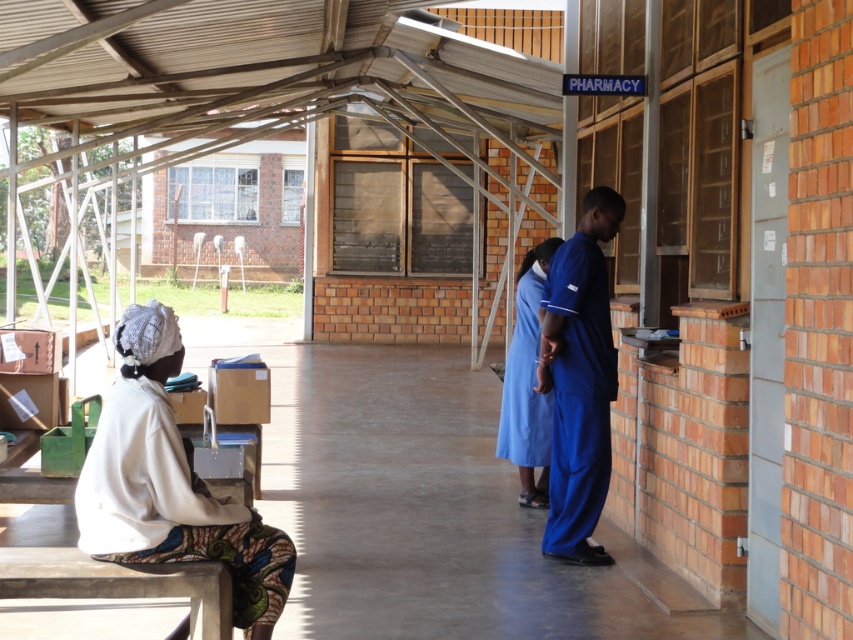
You are a tailor who needs to measure the space between two items of clothing. You see a blue fabric pants at right and a blue fabric dress at center. Can you fit a 36 inch ruler between them?

The distance between the blue fabric pants at right and the blue fabric dress at center is 34.98 inches, so the ruler cannot fit entirely between them since it is slightly longer than the space available.

You are a tailor who needs to determine which clothing item takes up more horizontal space on the bench. Based on the scene, which one is wider between the blue fabric pants at right and the blue fabric dress at center?

The blue fabric pants at right are wider than the blue fabric dress at center because the blue fabric pants at right has a larger width according to the description.